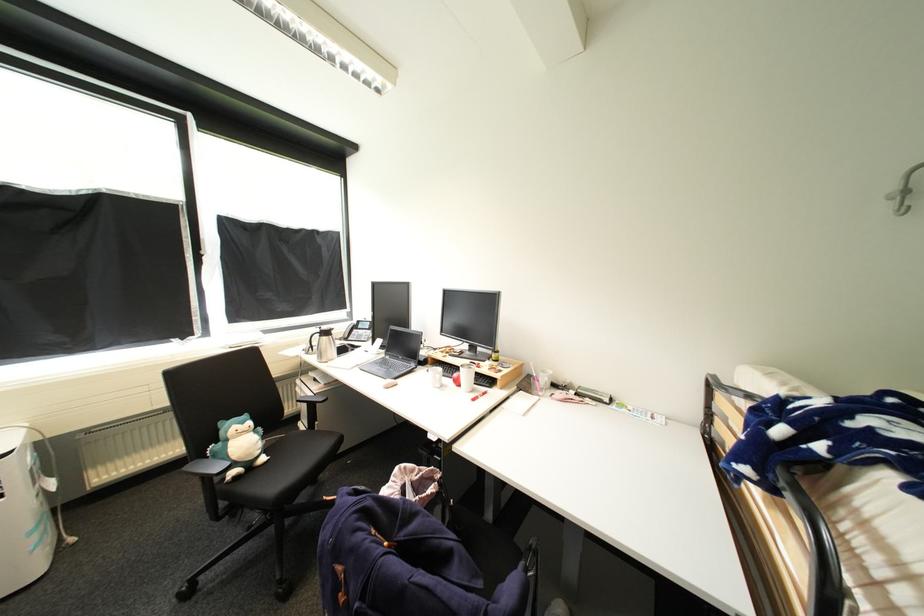
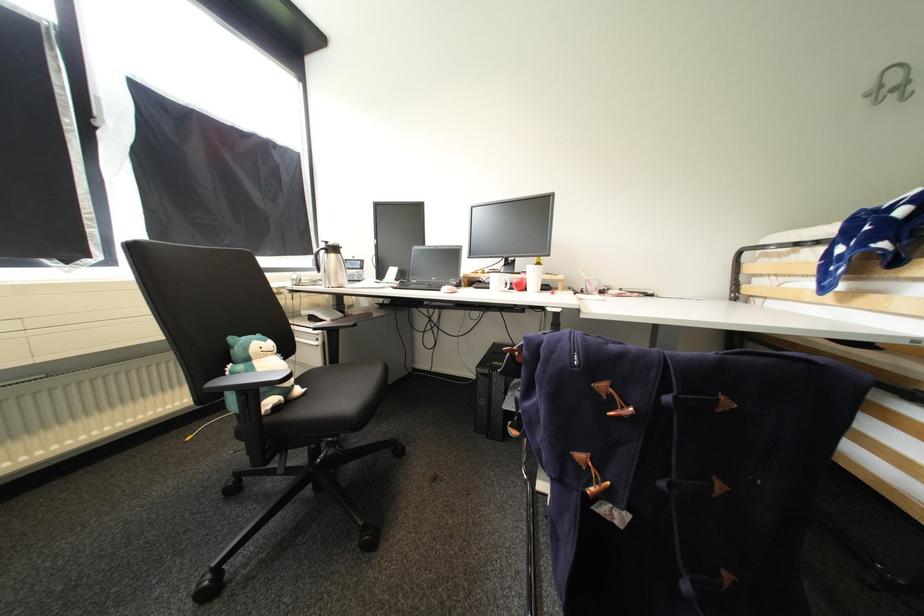
Find the pixel in the second image that matches point (249, 424) in the first image.

(272, 342)